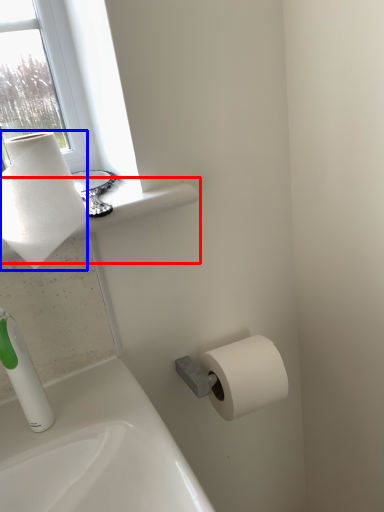
Question: Which of the following is the farthest to the observer, window sill (highlighted by a red box) or paper towel (highlighted by a blue box)?

Choices:
 (A) window sill
 (B) paper towel

Answer: (A)